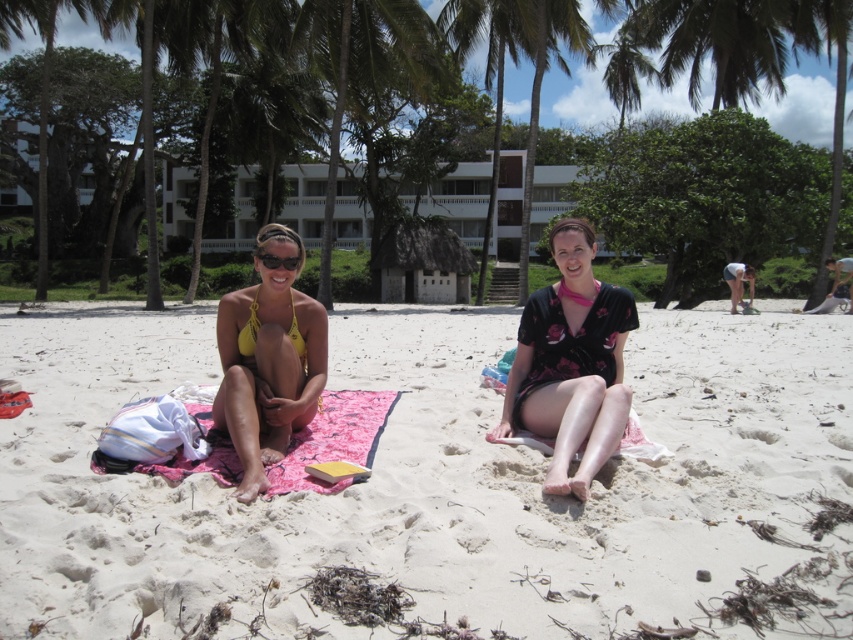
You are standing at the beach and see two points marked on the sand. The first point is at coordinate point(x=115, y=531) and the second is at point(x=578, y=353). Which point is closer to you?

Point(x=115, y=531) is in front of point(x=578, y=353), so it is closer to you.